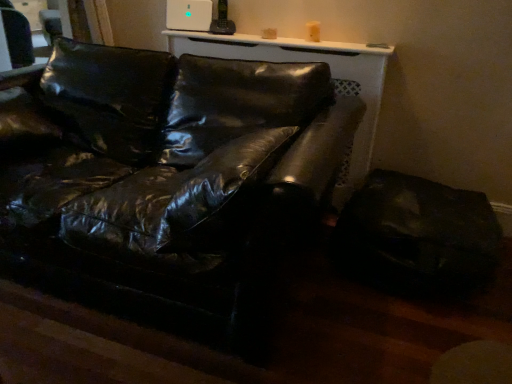
You are a GUI agent. You are given a task and a screenshot of the screen. Output one action in this format:
    pyautogui.click(x=<x>, y=<y>)
    Task: Click on the glossy black leather couch at center
    The width and height of the screenshot is (512, 384).
    Given the screenshot: What is the action you would take?
    pyautogui.click(x=170, y=169)

The image size is (512, 384). Describe the element at coordinates (170, 169) in the screenshot. I see `glossy black leather couch at center` at that location.

This screenshot has height=384, width=512. I want to click on shiny black leather swivel chair at lower right, so click(x=417, y=235).

Describe the element at coordinates (417, 235) in the screenshot. I see `shiny black leather swivel chair at lower right` at that location.

Find the location of a particular element. The height and width of the screenshot is (384, 512). glossy black leather couch at center is located at coordinates (170, 169).

Would you say shiny black leather swivel chair at lower right is to the left or to the right of glossy black leather couch at center in the picture?

In the image, shiny black leather swivel chair at lower right appears on the right side of glossy black leather couch at center.

In the image, is shiny black leather swivel chair at lower right positioned in front of or behind glossy black leather couch at center?

Clearly, shiny black leather swivel chair at lower right is behind glossy black leather couch at center.

Is point (451, 221) positioned before point (251, 146)?

No, (451, 221) is further to viewer.

From the image's perspective, which object appears higher, shiny black leather swivel chair at lower right or glossy black leather couch at center?

glossy black leather couch at center.

From a real-world perspective, which object stands above the other?

In real-world perspective, glossy black leather couch at center is above.

Between shiny black leather swivel chair at lower right and glossy black leather couch at center, which one has larger width?

glossy black leather couch at center.

Is shiny black leather swivel chair at lower right taller than glossy black leather couch at center?

No.

Considering the relative sizes of shiny black leather swivel chair at lower right and glossy black leather couch at center in the image provided, is shiny black leather swivel chair at lower right bigger than glossy black leather couch at center?

Actually, shiny black leather swivel chair at lower right might be smaller than glossy black leather couch at center.

Is shiny black leather swivel chair at lower right spatially inside glossy black leather couch at center, or outside of it?

shiny black leather swivel chair at lower right exists outside the volume of glossy black leather couch at center.

Is shiny black leather swivel chair at lower right not close to glossy black leather couch at center?

No, shiny black leather swivel chair at lower right is in close proximity to glossy black leather couch at center.

Is shiny black leather swivel chair at lower right oriented towards glossy black leather couch at center?

No, shiny black leather swivel chair at lower right is not aimed at glossy black leather couch at center.

You are a GUI agent. You are given a task and a screenshot of the screen. Output one action in this format:
    pyautogui.click(x=<x>, y=<y>)
    Task: Click on the studio couch in front of the shiny black leather swivel chair at lower right
    Image resolution: width=512 pixels, height=384 pixels.
    Given the screenshot: What is the action you would take?
    pyautogui.click(x=170, y=169)

Is glossy black leather couch at center to the left or to the right of shiny black leather swivel chair at lower right in the image?

glossy black leather couch at center is to the left of shiny black leather swivel chair at lower right.

Which is behind, glossy black leather couch at center or shiny black leather swivel chair at lower right?

Positioned behind is shiny black leather swivel chair at lower right.

Is point (59, 191) closer to camera compared to point (372, 215)?

Yes, it is in front of point (372, 215).

From the image's perspective, who appears lower, glossy black leather couch at center or shiny black leather swivel chair at lower right?

shiny black leather swivel chair at lower right is shown below in the image.

From a real-world perspective, is glossy black leather couch at center physically below shiny black leather swivel chair at lower right?

No, from a real-world perspective, glossy black leather couch at center is not beneath shiny black leather swivel chair at lower right.

Does glossy black leather couch at center have a lesser width compared to shiny black leather swivel chair at lower right?

In fact, glossy black leather couch at center might be wider than shiny black leather swivel chair at lower right.

Which of these two, glossy black leather couch at center or shiny black leather swivel chair at lower right, stands taller?

glossy black leather couch at center is taller.

Between glossy black leather couch at center and shiny black leather swivel chair at lower right, which one has smaller size?

shiny black leather swivel chair at lower right is smaller.

Is shiny black leather swivel chair at lower right inside glossy black leather couch at center?

No, shiny black leather swivel chair at lower right is not a part of glossy black leather couch at center.

Is glossy black leather couch at center far from shiny black leather swivel chair at lower right?

No.

Is glossy black leather couch at center facing towards shiny black leather swivel chair at lower right?

No, glossy black leather couch at center is not turned towards shiny black leather swivel chair at lower right.

How different are the orientations of glossy black leather couch at center and shiny black leather swivel chair at lower right in degrees?

0.00026 degrees.

Find the location of `studio couch that appears on the left of shiny black leather swivel chair at lower right`. studio couch that appears on the left of shiny black leather swivel chair at lower right is located at coordinates coord(170,169).

This screenshot has height=384, width=512. I want to click on swivel chair that appears behind the glossy black leather couch at center, so click(417, 235).

At what (x,y) coordinates should I click in order to perform the action: click on studio couch in front of the shiny black leather swivel chair at lower right. Please return your answer as a coordinate pair (x, y). Looking at the image, I should click on (170, 169).